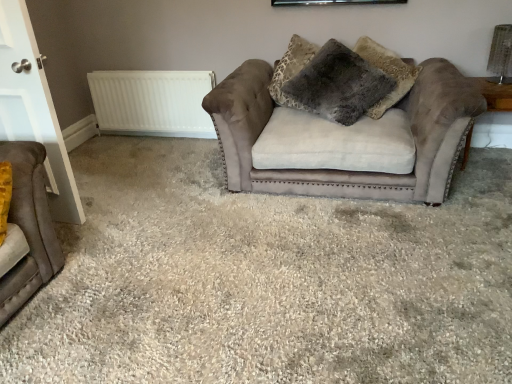
The width and height of the screenshot is (512, 384). What are the coordinates of `vacant space in front of suede-like beige couch at center, placed as the 2th studio couch when sorted from left to right` in the screenshot? It's located at (341, 276).